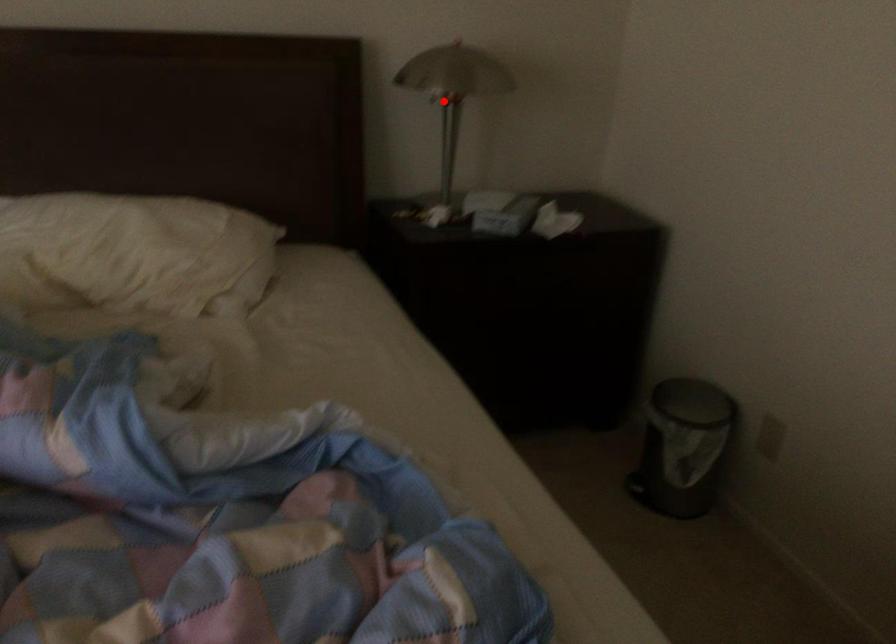
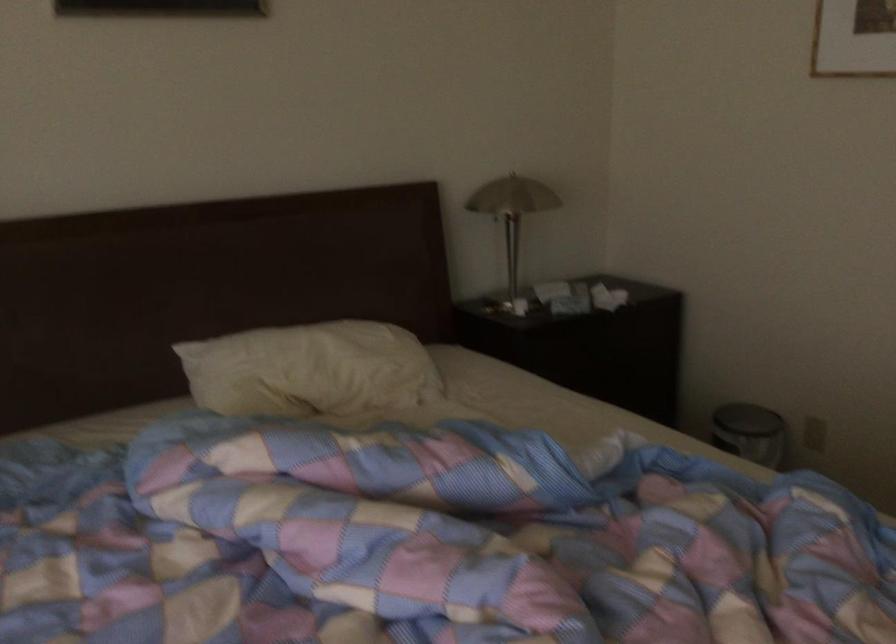
Question: I am providing you with two images of the same scene from different viewpoints. Image1 has a red point marked. In image2, the corresponding 3D location appears at what relative position? Reply with the corresponding letter.

Choices:
 (A) Closer
 (B) Farther

Answer: (B)